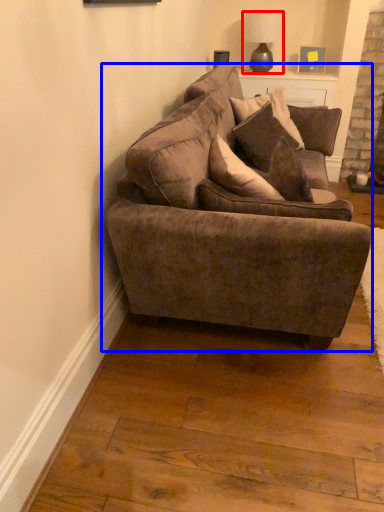
Question: Which object is closer to the camera taking this photo, lamp (highlighted by a red box) or studio couch (highlighted by a blue box)?

Choices:
 (A) lamp
 (B) studio couch

Answer: (B)